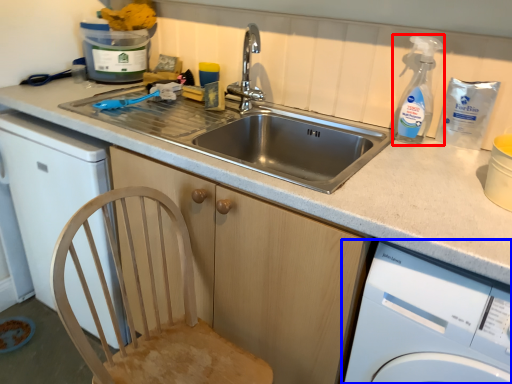
Question: Which of the following is the closest to the observer, cleaning product (highlighted by a red box) or washing machine (highlighted by a blue box)?

Choices:
 (A) cleaning product
 (B) washing machine

Answer: (B)